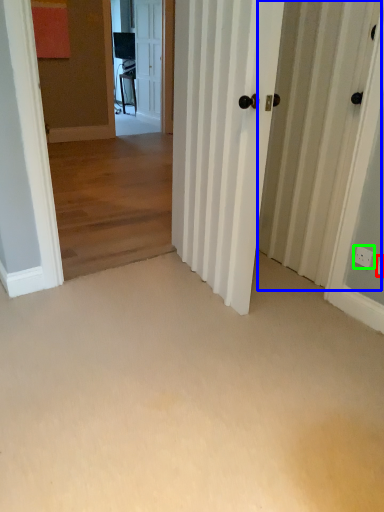
Question: Estimate the real-world distances between objects in this image. Which object is farther from electric outlet (highlighted by a red box), barn door (highlighted by a blue box) or electric outlet (highlighted by a green box)?

Choices:
 (A) barn door
 (B) electric outlet

Answer: (A)